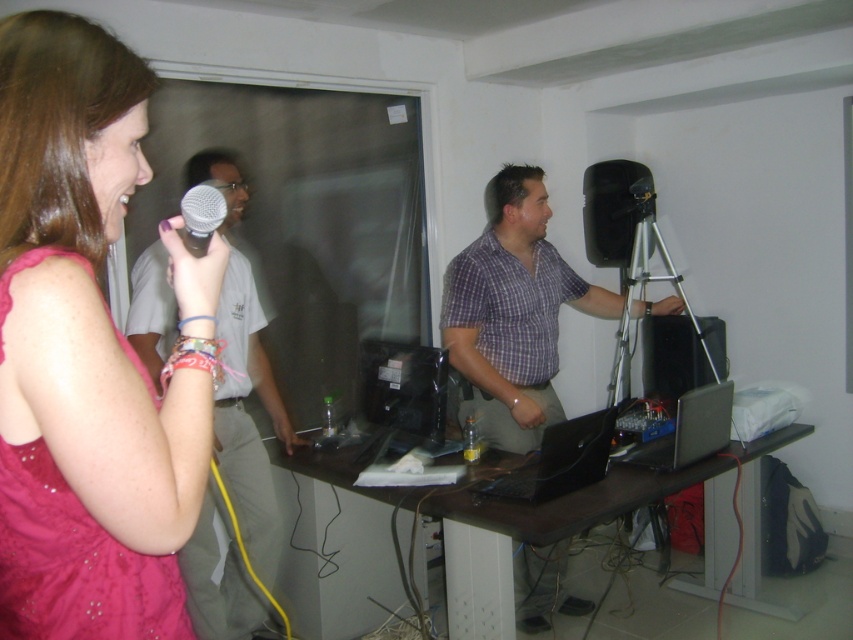
Which is more to the right, black matte laptop at center or silver metallic microphone at upper left?

black matte laptop at center is more to the right.

Who is lower down, black matte laptop at center or silver metallic microphone at upper left?

black matte laptop at center

Between point (601, 416) and point (183, 230), which one is positioned in front?

Positioned in front is point (183, 230).

Locate an element on the screen. black matte laptop at center is located at coordinates (560, 460).

Is black glossy monitor at center shorter than black plastic speaker at center?

Yes, black glossy monitor at center is shorter than black plastic speaker at center.

Is black glossy monitor at center thinner than black plastic speaker at center?

Yes.

Is point (376, 381) positioned in front of point (666, 406)?

Yes, point (376, 381) is in front of point (666, 406).

This screenshot has width=853, height=640. I want to click on black glossy monitor at center, so pos(405,388).

Can you confirm if light gray shirt at center is taller than black glossy monitor at center?

Correct, light gray shirt at center is much taller as black glossy monitor at center.

Is light gray shirt at center wider than black glossy monitor at center?

Indeed, light gray shirt at center has a greater width compared to black glossy monitor at center.

Does point (241, 179) lie behind point (389, 360)?

Yes, it is.

What are the coordinates of `light gray shirt at center` in the screenshot? It's located at (248, 417).